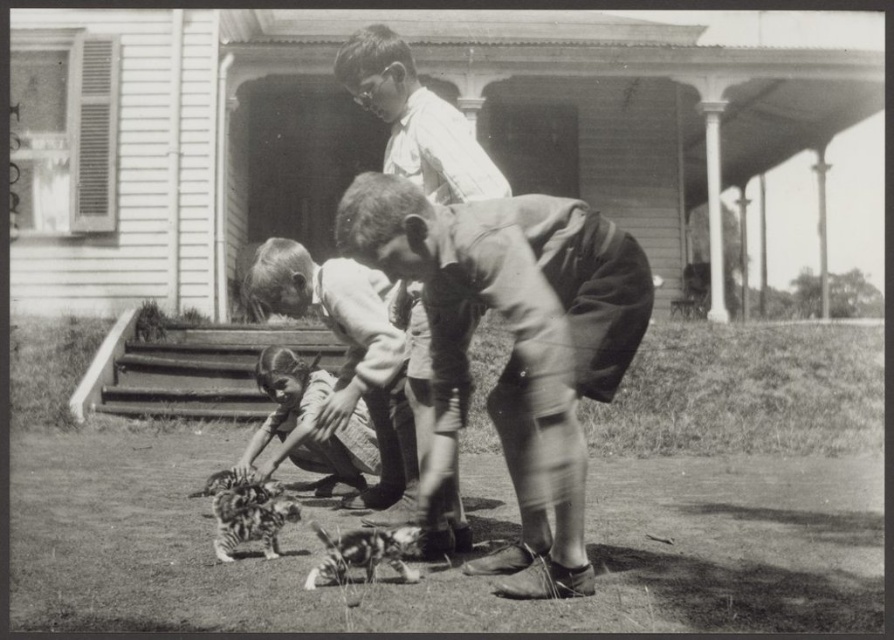
Question: Does leather boots at center appear on the right side of smooth fabric dress at lower left?

Choices:
 (A) yes
 (B) no

Answer: (A)

Question: Which of the following is the farthest from the observer?

Choices:
 (A) smooth fabric dress at lower left
 (B) leather boots at center
 (C) smooth fabric dress at center
 (D) smooth white shirt at center

Answer: (A)

Question: Which point is farther from the camera taking this photo?

Choices:
 (A) (353, 433)
 (B) (550, 401)
 (C) (393, 435)

Answer: (A)

Question: Is leather boots at center to the right of smooth white shirt at center from the viewer's perspective?

Choices:
 (A) no
 (B) yes

Answer: (B)

Question: Based on their relative distances, which object is nearer to the smooth fabric dress at lower left?

Choices:
 (A) smooth white shirt at center
 (B) smooth fabric dress at center

Answer: (B)

Question: Is smooth fabric dress at center below smooth fabric dress at lower left?

Choices:
 (A) yes
 (B) no

Answer: (B)